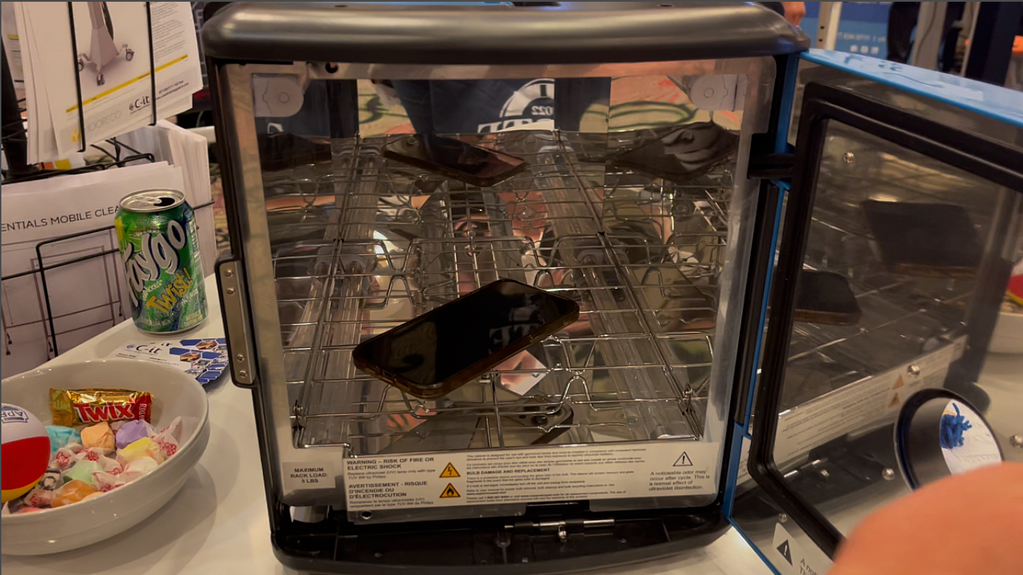
Find the location of a particular element. white table is located at coordinates (224, 474).